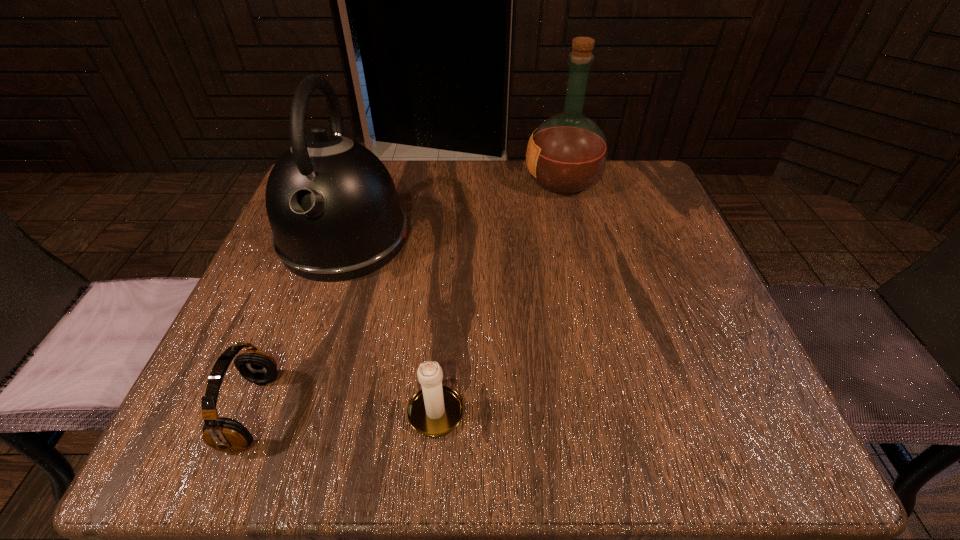
Image resolution: width=960 pixels, height=540 pixels. I want to click on free space that satisfies the following two spatial constraints: 1. on the spout of the kettle; 2. on the ear cups of the headset, so click(x=286, y=411).

Image resolution: width=960 pixels, height=540 pixels. In order to click on free region that satisfies the following two spatial constraints: 1. on the spout of the kettle; 2. on the ear cups of the headset in this screenshot , I will do `click(286, 411)`.

Identify the location of vacant area that satisfies the following two spatial constraints: 1. on the front label of the liquor; 2. on the spout of the kettle. (576, 238).